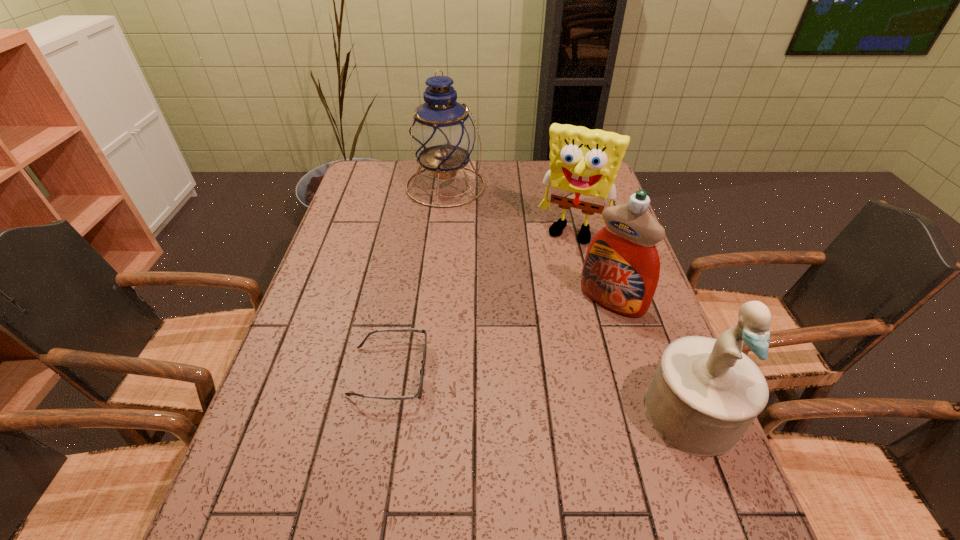
Locate an element on the screen. vacant space that is in between the farthest object and the figurine is located at coordinates (568, 299).

Image resolution: width=960 pixels, height=540 pixels. In order to click on free spot between the second farthest object and the sunglasses in this screenshot , I will do `click(481, 302)`.

Locate an element on the screen. free spot between the sunglasses and the farthest object is located at coordinates (418, 279).

The height and width of the screenshot is (540, 960). Identify the location of blank region between the shortest object and the tallest object. (418, 279).

The height and width of the screenshot is (540, 960). Identify the location of free spot between the figurine and the farthest object. (568, 299).

You are a GUI agent. You are given a task and a screenshot of the screen. Output one action in this format:
    pyautogui.click(x=<x>, y=<y>)
    Task: Click on the vacant area that lies between the figurine and the fourth nearest object
    
    Given the screenshot: What is the action you would take?
    pyautogui.click(x=632, y=322)

Locate an element on the screen. vacant region between the detergent and the figurine is located at coordinates (651, 356).

Locate which object ranks third in proximity to the figurine. Please provide its 2D coordinates. Your answer should be formatted as a tuple, i.e. [(x, y)], where the tuple contains the x and y coordinates of a point satisfying the conditions above.

[(419, 393)]

Identify the location of the fourth closest object to the fourth nearest object. (419, 393).